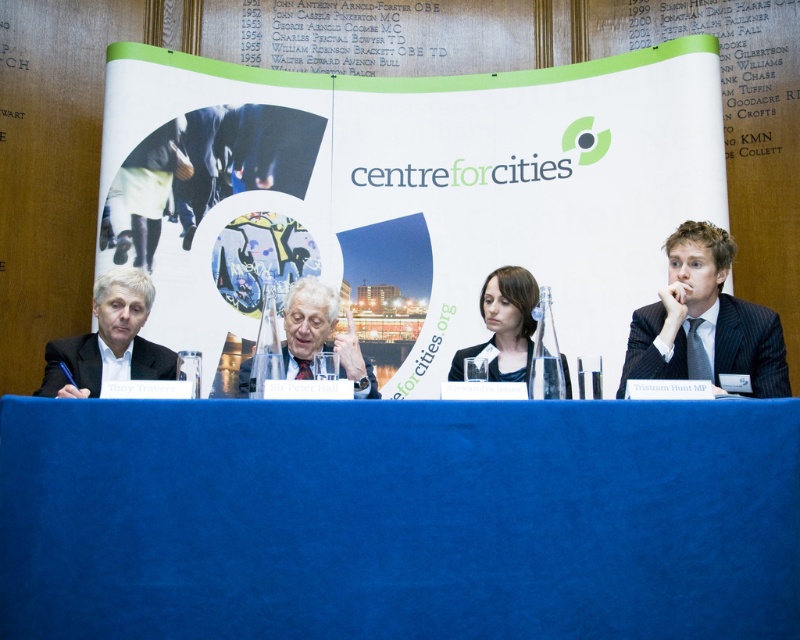
Question: Does blue fabric table at center have a smaller size compared to white shirt at left?

Choices:
 (A) no
 (B) yes

Answer: (B)

Question: Is blue fabric table at center further to camera compared to white shirt at left?

Choices:
 (A) yes
 (B) no

Answer: (B)

Question: Among these points, which one is farthest from the camera?

Choices:
 (A) (448, 230)
 (B) (520, 307)
 (C) (710, 228)
 (D) (120, 323)

Answer: (A)

Question: Which object is farther from the camera taking this photo?

Choices:
 (A) white shirt at left
 (B) matte black suit at center

Answer: (B)

Question: Which object is positioned farthest from the blue fabric table at center?

Choices:
 (A) white paper at center
 (B) dark blue suit at right
 (C) matte black suit at center
 (D) matte black hair at center

Answer: (A)

Question: Does dark blue suit at right have a greater width compared to matte black hair at center?

Choices:
 (A) yes
 (B) no

Answer: (A)